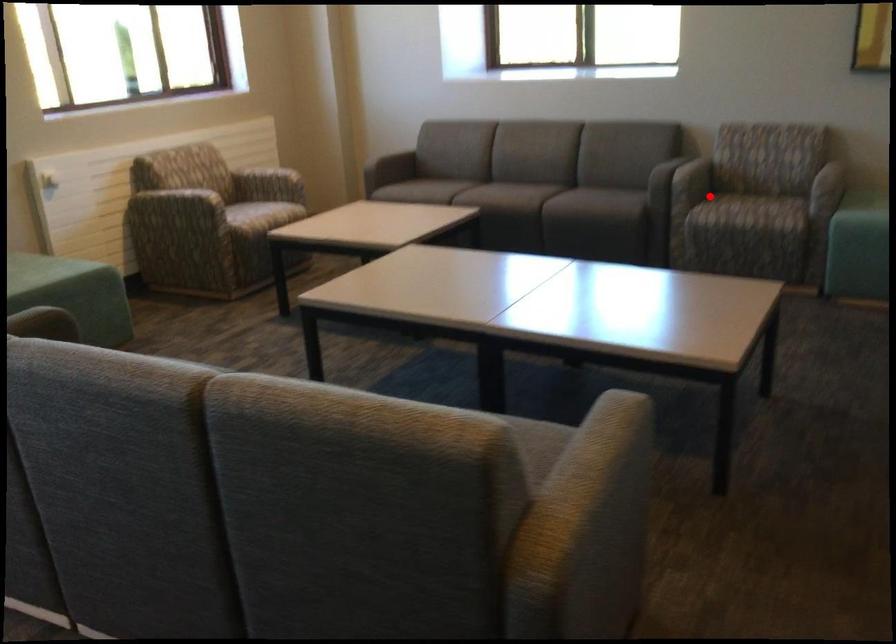
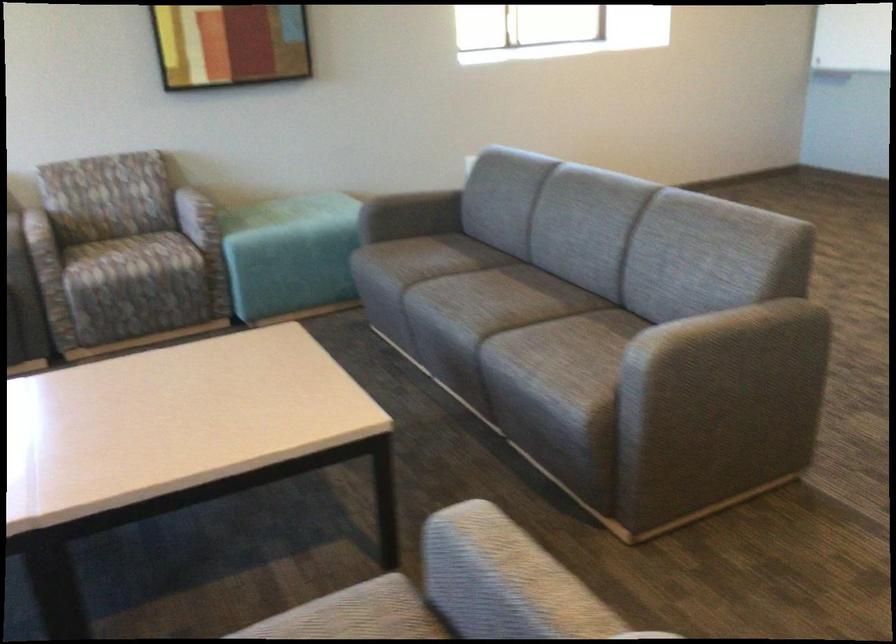
Question: I am providing you with two images of the same scene from different viewpoints. A red point is shown in image1. For the corresponding object point in image2, is it positioned nearer or farther from the camera?

Choices:
 (A) Nearer
 (B) Farther

Answer: (A)